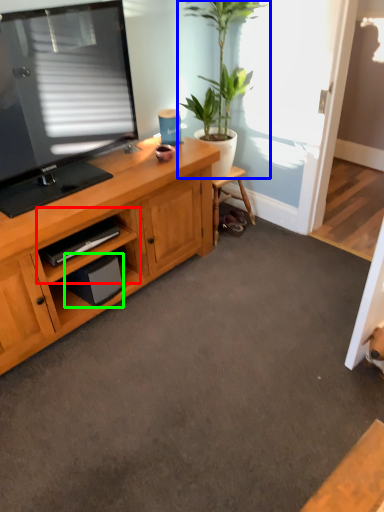
Question: Which object is positioned closest to cabinet (highlighted by a red box)? Select from houseplant (highlighted by a blue box) and speaker (highlighted by a green box).

Choices:
 (A) houseplant
 (B) speaker

Answer: (B)